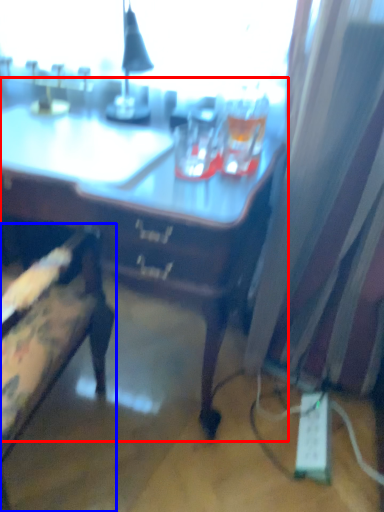
Question: Which object appears closest to the camera in this image, desk (highlighted by a red box) or chair (highlighted by a blue box)?

Choices:
 (A) desk
 (B) chair

Answer: (B)